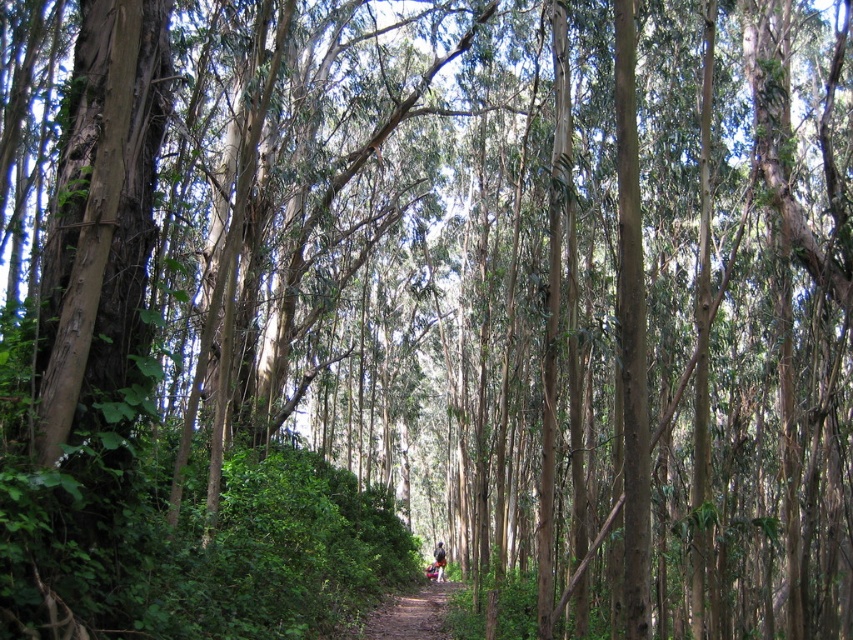
You are a hiker carrying a heavy backpack and need to reach the camouflage fabric person at center. The brown dirt path at center is 1.2 meters wide. Can you walk straight along the path to reach them without stepping off the path?

The brown dirt path at center is 1.2 meters wide, so yes, you can walk straight along the path to reach the camouflage fabric person at center without stepping off the path since the path is wide enough for a hiker carrying a backpack.

You are a hiker standing at the start of the forest path. You see the brown dirt path at center and the camouflage fabric person at center. Which direction should you walk to reach the person?

The brown dirt path at center is to the left of the camouflage fabric person at center, so you should walk to the right to reach the person.

You are a hiker planning to walk along the brown dirt path at center. There is a camouflage fabric person at center nearby. Which object takes up more space in the image?

The brown dirt path at center takes up more space in the image than the camouflage fabric person at center because it is bigger.